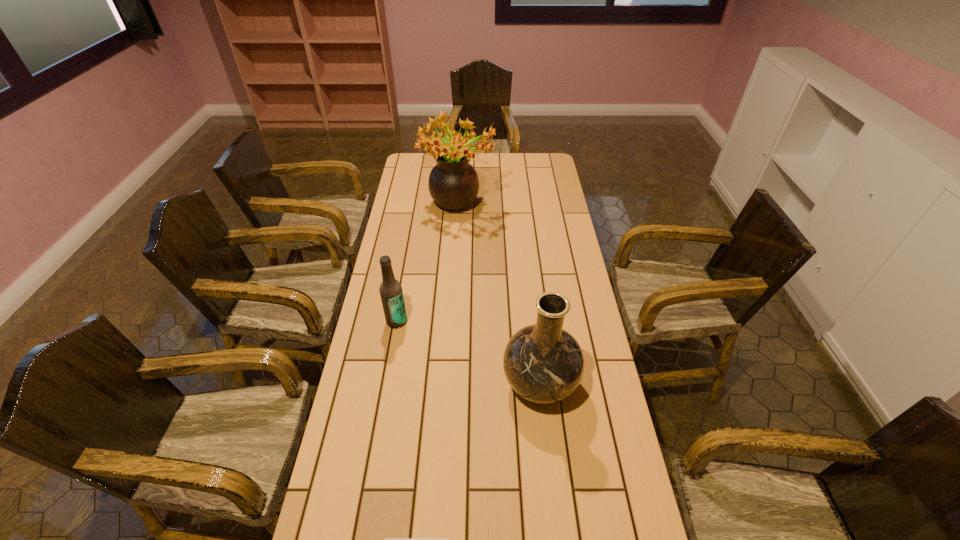
This screenshot has height=540, width=960. What are the coordinates of `object that is at the right edge` in the screenshot? It's located at (543, 363).

Image resolution: width=960 pixels, height=540 pixels. I want to click on blank space at the far edge of the desktop, so click(x=492, y=164).

You are a GUI agent. You are given a task and a screenshot of the screen. Output one action in this format:
    pyautogui.click(x=<x>, y=<y>)
    Task: Click on the vacant space at the left edge of the desktop
    The width and height of the screenshot is (960, 540).
    Given the screenshot: What is the action you would take?
    pyautogui.click(x=334, y=465)

Locate an element on the screen. The width and height of the screenshot is (960, 540). vacant space at the right edge of the desktop is located at coordinates (593, 367).

In the image, there is a desktop. At what (x,y) coordinates should I click in order to perform the action: click on free region at the far left corner. Please return your answer as a coordinate pair (x, y). The width and height of the screenshot is (960, 540). Looking at the image, I should click on (433, 161).

Locate an element on the screen. free space between the second shortest object and the rightmost object is located at coordinates 468,353.

I want to click on unoccupied position between the second farthest object and the farthest object, so click(x=427, y=264).

Where is `empty space that is in between the second shortest object and the farthest object`? empty space that is in between the second shortest object and the farthest object is located at coordinates (427, 264).

You are a GUI agent. You are given a task and a screenshot of the screen. Output one action in this format:
    pyautogui.click(x=<x>, y=<y>)
    Task: Click on the vacant point located between the flower arrangement and the third nearest object
    This screenshot has width=960, height=540.
    Given the screenshot: What is the action you would take?
    pyautogui.click(x=427, y=264)

Choose which object is the third nearest neighbor to the nearest object. Please provide its 2D coordinates. Your answer should be formatted as a tuple, i.e. [(x, y)], where the tuple contains the x and y coordinates of a point satisfying the conditions above.

[(453, 183)]